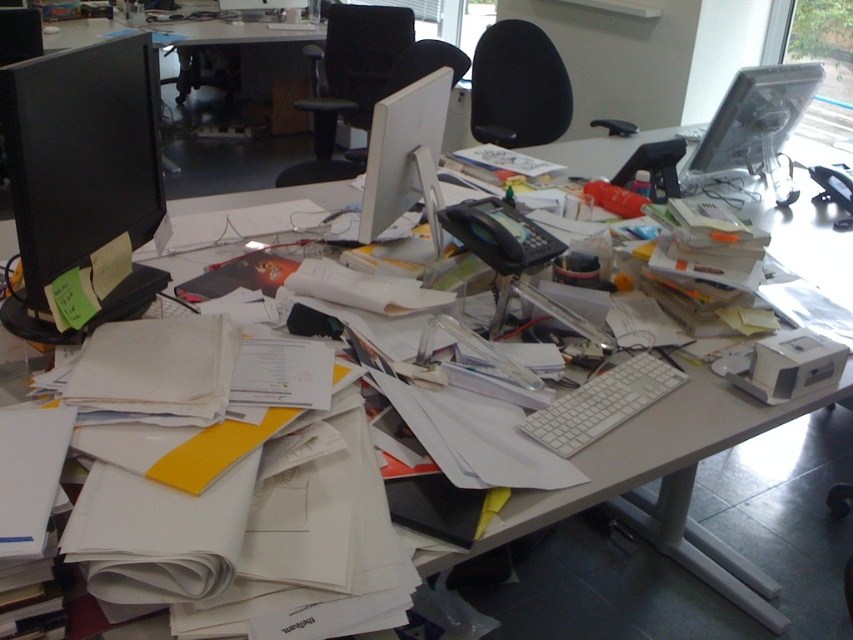
Question: Among these points, which one is nearest to the camera?

Choices:
 (A) (302, 81)
 (B) (57, 156)

Answer: (B)

Question: Which point appears closest to the camera in this image?

Choices:
 (A) (439, 230)
 (B) (735, 170)
 (C) (347, 36)

Answer: (A)

Question: Which of these objects is positioned farthest from the matte black monitor at upper left?

Choices:
 (A) matte black monitor at left
 (B) matte black monitor at upper right
 (C) white plastic keyboard at center
 (D) white glossy computer monitor at center

Answer: (C)

Question: Does matte black monitor at upper right have a lesser width compared to matte black monitor at upper left?

Choices:
 (A) yes
 (B) no

Answer: (A)

Question: Does matte black monitor at left appear over white plastic keyboard at center?

Choices:
 (A) no
 (B) yes

Answer: (B)

Question: Is black fabric swivel chair at center smaller than matte black monitor at upper right?

Choices:
 (A) yes
 (B) no

Answer: (B)